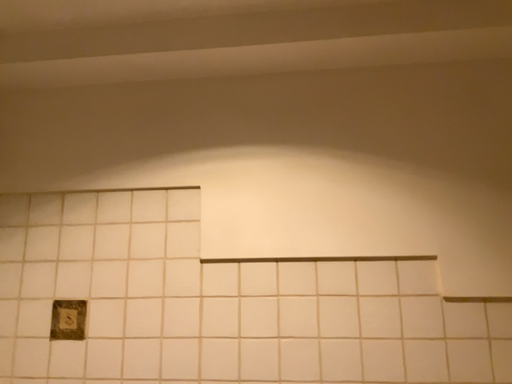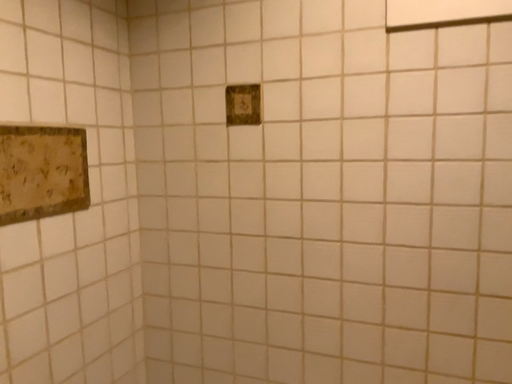
Question: How did the camera likely rotate when shooting the video?

Choices:
 (A) rotated left
 (B) rotated right

Answer: (A)